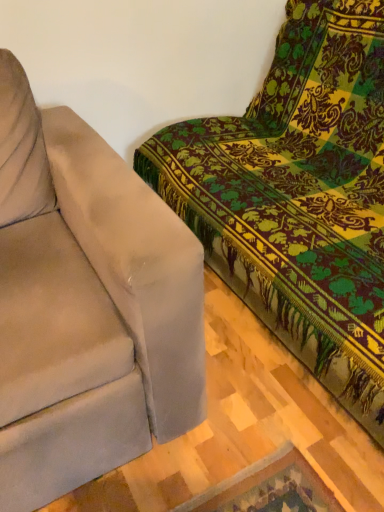
The height and width of the screenshot is (512, 384). Describe the element at coordinates (86, 305) in the screenshot. I see `suede-like beige couch at left, which is the first studio couch from left to right` at that location.

How much space does suede-like beige couch at left, which is the first studio couch from left to right, occupy vertically?

suede-like beige couch at left, which is the first studio couch from left to right, is 35.16 inches in height.

What are the coordinates of `suede-like beige couch at left, marked as the second studio couch in a right-to-left arrangement` in the screenshot? It's located at (86, 305).

What is the approximate width of suede-like beige couch at left, which is the first studio couch from left to right?

suede-like beige couch at left, which is the first studio couch from left to right, is 3.58 feet in width.

How much space does velvet beige couch at upper right, the first studio couch when ordered from right to left, occupy horizontally?

velvet beige couch at upper right, the first studio couch when ordered from right to left, is 1.13 meters in width.

Where is `velvet beige couch at upper right, the first studio couch when ordered from right to left`? Image resolution: width=384 pixels, height=512 pixels. velvet beige couch at upper right, the first studio couch when ordered from right to left is located at coordinates (299, 196).

Describe the element at coordinates (299, 196) in the screenshot. I see `velvet beige couch at upper right, which is counted as the second studio couch, starting from the left` at that location.

Where is `suede-like beige couch at left, which is the first studio couch from left to right`? This screenshot has width=384, height=512. suede-like beige couch at left, which is the first studio couch from left to right is located at coordinates (86, 305).

Which is more to the left, suede-like beige couch at left, which is the first studio couch from left to right, or velvet beige couch at upper right, which is counted as the second studio couch, starting from the left?

suede-like beige couch at left, which is the first studio couch from left to right.

Is suede-like beige couch at left, which is the first studio couch from left to right, further to the viewer compared to velvet beige couch at upper right, the first studio couch when ordered from right to left?

Yes, it is behind velvet beige couch at upper right, the first studio couch when ordered from right to left.

Does point (98, 149) come in front of point (357, 379)?

No, (98, 149) is further to viewer.

From the image's perspective, which one is positioned lower, suede-like beige couch at left, marked as the second studio couch in a right-to-left arrangement, or velvet beige couch at upper right, the first studio couch when ordered from right to left?

suede-like beige couch at left, marked as the second studio couch in a right-to-left arrangement, is shown below in the image.

From a real-world perspective, is suede-like beige couch at left, marked as the second studio couch in a right-to-left arrangement, positioned under velvet beige couch at upper right, the first studio couch when ordered from right to left, based on gravity?

Indeed, from a real-world perspective, suede-like beige couch at left, marked as the second studio couch in a right-to-left arrangement, is positioned beneath velvet beige couch at upper right, the first studio couch when ordered from right to left.

Can you confirm if suede-like beige couch at left, marked as the second studio couch in a right-to-left arrangement, is thinner than velvet beige couch at upper right, which is counted as the second studio couch, starting from the left?

Indeed, suede-like beige couch at left, marked as the second studio couch in a right-to-left arrangement, has a lesser width compared to velvet beige couch at upper right, which is counted as the second studio couch, starting from the left.

Does suede-like beige couch at left, which is the first studio couch from left to right, have a lesser height compared to velvet beige couch at upper right, which is counted as the second studio couch, starting from the left?

Indeed, suede-like beige couch at left, which is the first studio couch from left to right, has a lesser height compared to velvet beige couch at upper right, which is counted as the second studio couch, starting from the left.

Considering the relative sizes of suede-like beige couch at left, marked as the second studio couch in a right-to-left arrangement, and velvet beige couch at upper right, the first studio couch when ordered from right to left, in the image provided, is suede-like beige couch at left, marked as the second studio couch in a right-to-left arrangement, bigger than velvet beige couch at upper right, the first studio couch when ordered from right to left,?

No, suede-like beige couch at left, marked as the second studio couch in a right-to-left arrangement, is not bigger than velvet beige couch at upper right, the first studio couch when ordered from right to left.

Is suede-like beige couch at left, marked as the second studio couch in a right-to-left arrangement, surrounding velvet beige couch at upper right, the first studio couch when ordered from right to left?

Definitely not — velvet beige couch at upper right, the first studio couch when ordered from right to left, is not inside suede-like beige couch at left, marked as the second studio couch in a right-to-left arrangement.

Is suede-like beige couch at left, marked as the second studio couch in a right-to-left arrangement, in contact with velvet beige couch at upper right, which is counted as the second studio couch, starting from the left?

suede-like beige couch at left, marked as the second studio couch in a right-to-left arrangement, and velvet beige couch at upper right, which is counted as the second studio couch, starting from the left, are clearly separated.

Is suede-like beige couch at left, marked as the second studio couch in a right-to-left arrangement, positioned with its back to velvet beige couch at upper right, which is counted as the second studio couch, starting from the left?

That's not correct — suede-like beige couch at left, marked as the second studio couch in a right-to-left arrangement, is not looking away from velvet beige couch at upper right, which is counted as the second studio couch, starting from the left.

There is a suede-like beige couch at left, marked as the second studio couch in a right-to-left arrangement. Where is `studio couch above it (from a real-world perspective)`? This screenshot has height=512, width=384. studio couch above it (from a real-world perspective) is located at coordinates (299, 196).

Is velvet beige couch at upper right, the first studio couch when ordered from right to left, to the right of suede-like beige couch at left, which is the first studio couch from left to right, from the viewer's perspective?

Yes.

Is velvet beige couch at upper right, which is counted as the second studio couch, starting from the left, in front of suede-like beige couch at left, marked as the second studio couch in a right-to-left arrangement?

Yes, velvet beige couch at upper right, which is counted as the second studio couch, starting from the left, is closer to the camera.

Does point (289, 294) lie behind point (58, 212)?

That is False.

From the picture: From the image's perspective, who appears lower, velvet beige couch at upper right, the first studio couch when ordered from right to left, or suede-like beige couch at left, which is the first studio couch from left to right?

suede-like beige couch at left, which is the first studio couch from left to right, appears lower in the image.

From a real-world perspective, which object rests below the other?

suede-like beige couch at left, which is the first studio couch from left to right, is physically lower.

Between velvet beige couch at upper right, which is counted as the second studio couch, starting from the left, and suede-like beige couch at left, which is the first studio couch from left to right, which one has smaller width?

Thinner between the two is suede-like beige couch at left, which is the first studio couch from left to right.

Based on the photo, who is shorter, velvet beige couch at upper right, the first studio couch when ordered from right to left, or suede-like beige couch at left, which is the first studio couch from left to right?

suede-like beige couch at left, which is the first studio couch from left to right.

Is velvet beige couch at upper right, the first studio couch when ordered from right to left, smaller than suede-like beige couch at left, which is the first studio couch from left to right?

No.

Does velvet beige couch at upper right, which is counted as the second studio couch, starting from the left, contain suede-like beige couch at left, which is the first studio couch from left to right?

No.

Is velvet beige couch at upper right, which is counted as the second studio couch, starting from the left, next to suede-like beige couch at left, marked as the second studio couch in a right-to-left arrangement, and touching it?

velvet beige couch at upper right, which is counted as the second studio couch, starting from the left, is not next to suede-like beige couch at left, marked as the second studio couch in a right-to-left arrangement, and they're not touching.

Is velvet beige couch at upper right, which is counted as the second studio couch, starting from the left, positioned with its back to suede-like beige couch at left, which is the first studio couch from left to right?

No.

Can you tell me how much velvet beige couch at upper right, which is counted as the second studio couch, starting from the left, and suede-like beige couch at left, marked as the second studio couch in a right-to-left arrangement, differ in facing direction?

The angular difference between velvet beige couch at upper right, which is counted as the second studio couch, starting from the left, and suede-like beige couch at left, marked as the second studio couch in a right-to-left arrangement, is 90 degrees.

Where is `studio couch above the suede-like beige couch at left, which is the first studio couch from left to right (from the image's perspective)`? The width and height of the screenshot is (384, 512). studio couch above the suede-like beige couch at left, which is the first studio couch from left to right (from the image's perspective) is located at coordinates (299, 196).

The height and width of the screenshot is (512, 384). I want to click on studio couch above the suede-like beige couch at left, which is the first studio couch from left to right (from the image's perspective), so click(x=299, y=196).

This screenshot has height=512, width=384. I want to click on studio couch located on the left of velvet beige couch at upper right, which is counted as the second studio couch, starting from the left, so click(x=86, y=305).